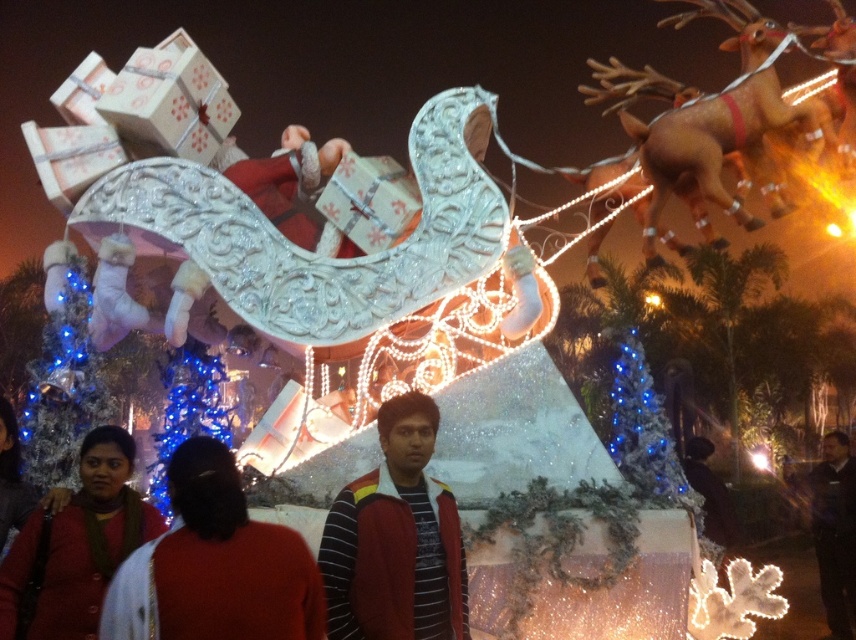
Question: Which point appears closest to the camera in this image?

Choices:
 (A) (853, 547)
 (B) (40, 374)

Answer: (B)

Question: Is red fabric dress at lower left above striped sweater at center?

Choices:
 (A) no
 (B) yes

Answer: (A)

Question: Is striped sweater at center closer to the viewer compared to red woolen sweater at lower left?

Choices:
 (A) no
 (B) yes

Answer: (B)

Question: Which point is closer to the camera?

Choices:
 (A) (687, 456)
 (B) (845, 570)
 (C) (158, 628)
 (D) (51, 369)

Answer: (C)

Question: Which of these objects is positioned closest to the red fabric dress at lower left?

Choices:
 (A) dark fabric jacket at lower right
 (B) striped sweater at center
 (C) black leather jacket at lower right
 (D) blue glittering lights at lower left

Answer: (B)

Question: Does red fabric dress at lower left have a greater width compared to red woolen sweater at lower left?

Choices:
 (A) yes
 (B) no

Answer: (A)